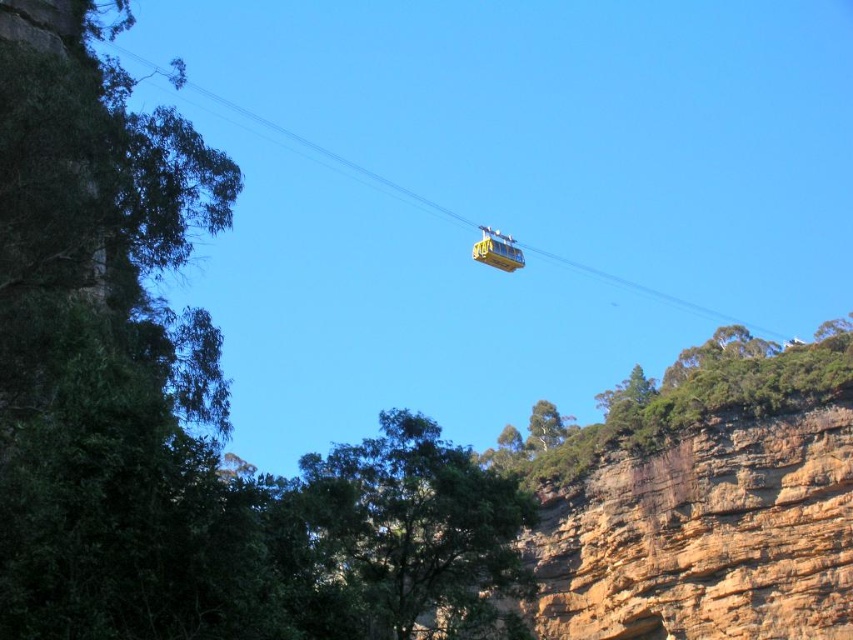
Based on the photo, is brown rocky cliff at lower right smaller than green leafy tree at center?

Actually, brown rocky cliff at lower right might be larger than green leafy tree at center.

Which is behind, point (836, 532) or point (390, 484)?

The point (836, 532) is more distant.

Based on the photo, measure the distance between brown rocky cliff at lower right and camera.

The distance of brown rocky cliff at lower right from camera is 228.70 feet.

Find the location of a particular element. The height and width of the screenshot is (640, 853). brown rocky cliff at lower right is located at coordinates (703, 538).

Is point (637, 483) positioned before point (601, 449)?

Yes, point (637, 483) is in front of point (601, 449).

Can you confirm if brown rocky cliff at lower right is smaller than green rough rock at upper right?

Indeed, brown rocky cliff at lower right has a smaller size compared to green rough rock at upper right.

Is point (515, 609) in front of point (573, 428)?

Yes, point (515, 609) is closer to viewer.

This screenshot has height=640, width=853. Find the location of `brown rocky cliff at lower right`. brown rocky cliff at lower right is located at coordinates (703, 538).

Does green leafy tree at center appear over yellow matte cable car at upper center?

No.

How far apart are green leafy tree at center and yellow matte cable car at upper center?

green leafy tree at center is 61.00 meters from yellow matte cable car at upper center.

Is point (421, 420) in front of point (511, 272)?

Yes.

The width and height of the screenshot is (853, 640). Identify the location of green leafy tree at center. (418, 531).